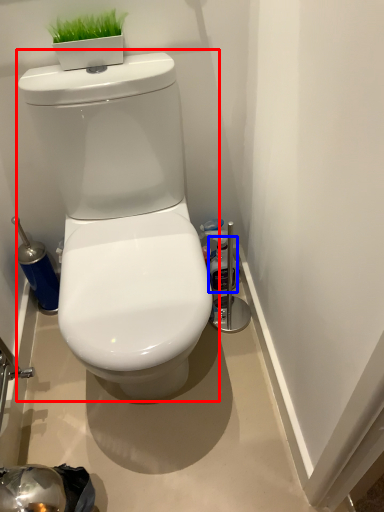
Question: Which object is closer to the camera taking this photo, toilet (highlighted by a red box) or bottle (highlighted by a blue box)?

Choices:
 (A) toilet
 (B) bottle

Answer: (A)